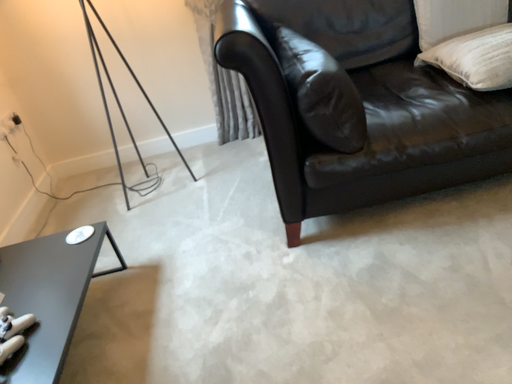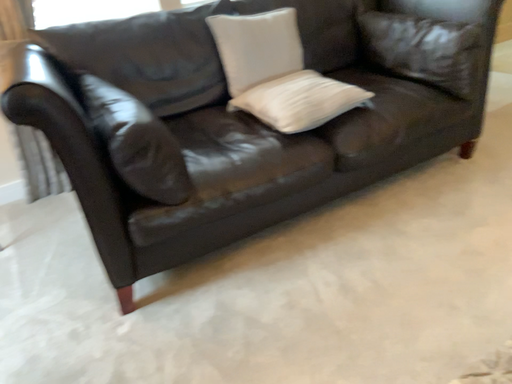
Question: How did the camera likely rotate when shooting the video?

Choices:
 (A) rotated right
 (B) rotated left

Answer: (A)